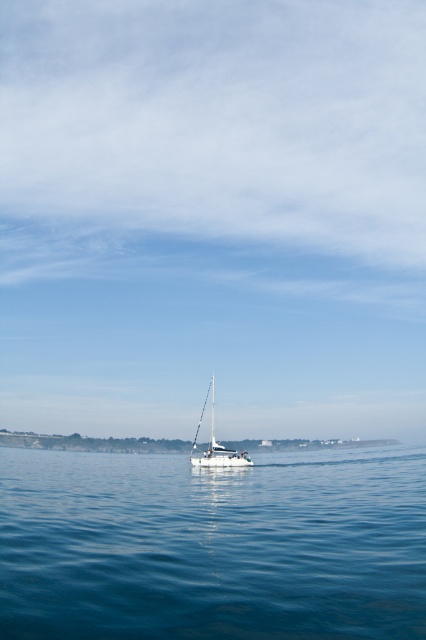
Question: Is transparent glass sailboat at center bigger than smooth sand at lower center?

Choices:
 (A) yes
 (B) no

Answer: (A)

Question: Which of the following is the closest to the observer?

Choices:
 (A) white glossy sailboat at center
 (B) transparent glass sailboat at center

Answer: (A)

Question: Does blue liquid water at center appear over white glossy sailboat at center?

Choices:
 (A) yes
 (B) no

Answer: (A)

Question: Which point is farther to the camera?

Choices:
 (A) smooth sand at lower center
 (B) white glossy sailboat at center
 (C) blue liquid water at center
 (D) transparent glass sailboat at center

Answer: (D)

Question: Among these points, which one is nearest to the camera?

Choices:
 (A) (226, 454)
 (B) (389, 440)

Answer: (A)

Question: Does smooth sand at lower center appear on the right side of white glossy sailboat at center?

Choices:
 (A) yes
 (B) no

Answer: (A)